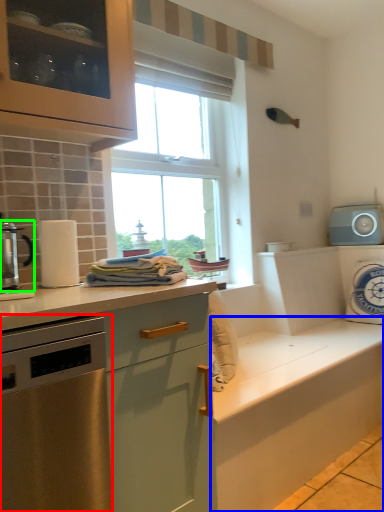
Question: Which object is the farthest from home appliance (highlighted by a red box)? Choose among these: cabinetry (highlighted by a blue box) or kitchen appliance (highlighted by a green box).

Choices:
 (A) cabinetry
 (B) kitchen appliance

Answer: (A)